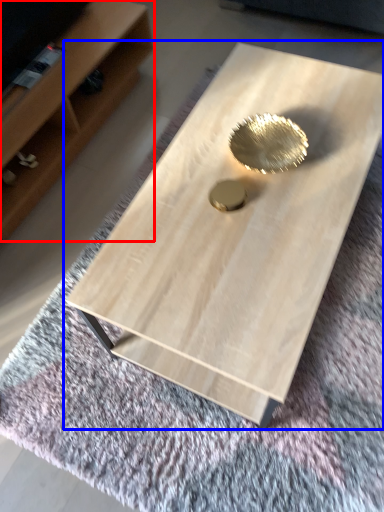
Question: Which of the following is the farthest to the observer, shelf (highlighted by a red box) or coffee table (highlighted by a blue box)?

Choices:
 (A) shelf
 (B) coffee table

Answer: (A)